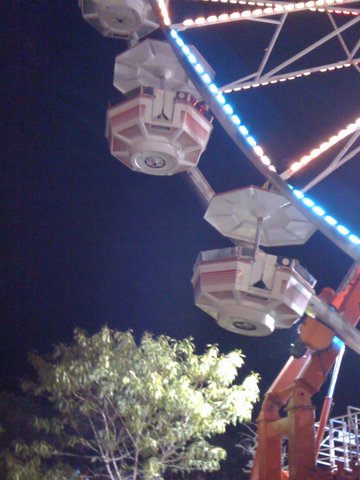
Image resolution: width=360 pixels, height=480 pixels. I want to click on carts, so point(249,282), point(160,109), point(126,16).